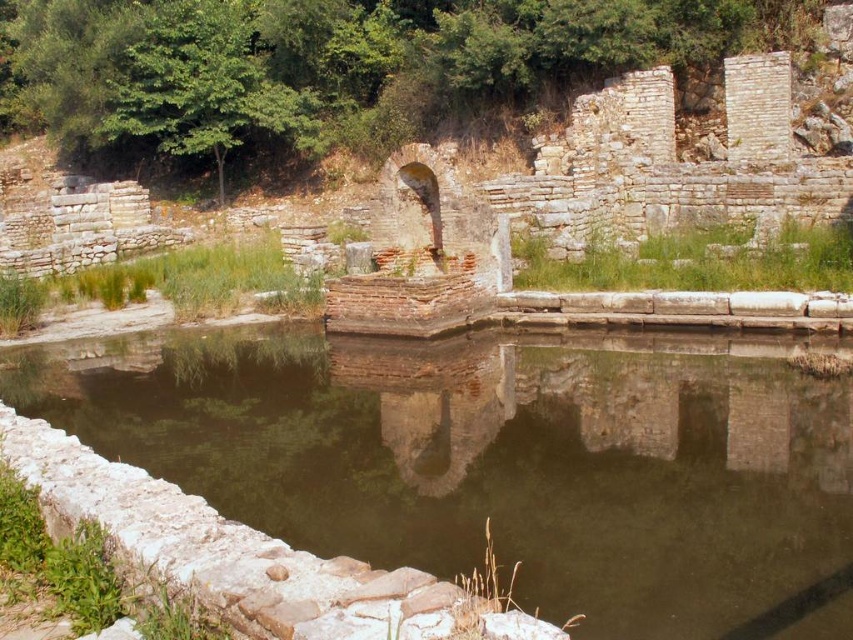
Question: Does smooth stone pool at center appear on the left side of white stone moat at lower left?

Choices:
 (A) no
 (B) yes

Answer: (A)

Question: Can you confirm if smooth stone pool at center is positioned below white stone moat at lower left?

Choices:
 (A) yes
 (B) no

Answer: (B)

Question: Which object is closer to the camera taking this photo?

Choices:
 (A) smooth stone pool at center
 (B) white stone moat at lower left

Answer: (B)

Question: Can you confirm if smooth stone pool at center is wider than white stone moat at lower left?

Choices:
 (A) no
 (B) yes

Answer: (B)

Question: Which object is closer to the camera taking this photo?

Choices:
 (A) smooth stone pool at center
 (B) white stone moat at lower left

Answer: (B)

Question: Among these objects, which one is nearest to the camera?

Choices:
 (A) smooth stone pool at center
 (B) white stone moat at lower left

Answer: (B)